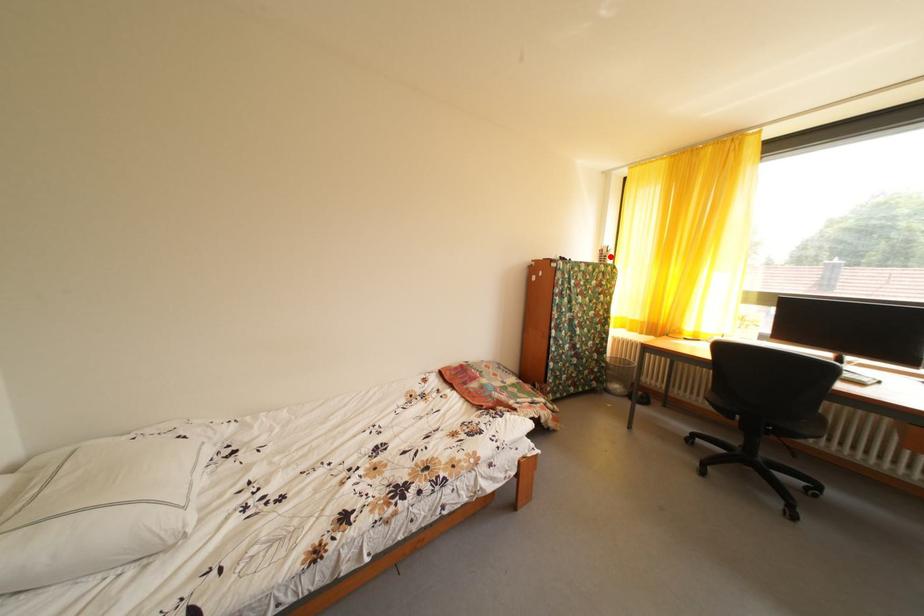
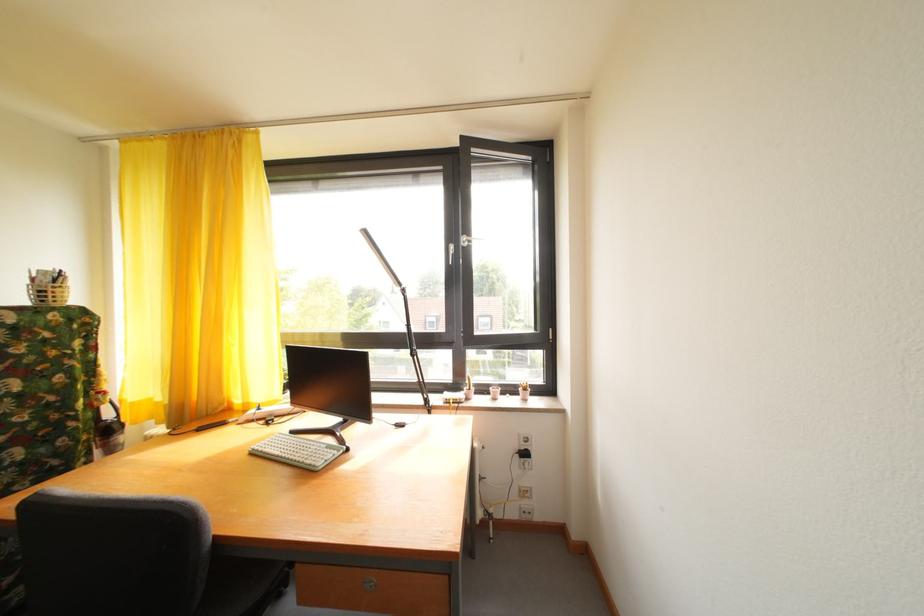
The point at the highlighted location is marked in the first image. Where is the corresponding point in the second image?

(43, 286)